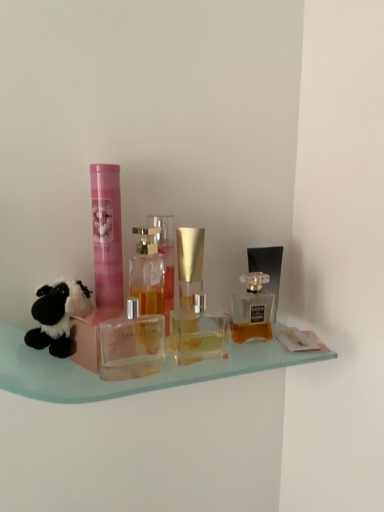
Question: Is matte black perfume at right, which is counted as the 2th toiletry, starting from the left, completely or partially outside of clear glass perfume bottle at center, which appears as the 3th bottle when viewed from the right?

Choices:
 (A) no
 (B) yes

Answer: (B)

Question: Is matte black perfume at right, acting as the first toiletry starting from the right, facing towards clear glass perfume bottle at center, positioned as the second bottle in left-to-right order?

Choices:
 (A) no
 (B) yes

Answer: (A)

Question: Is matte black perfume at right, which is counted as the 2th toiletry, starting from the left, in front of clear glass perfume bottle at center, which appears as the 3th bottle when viewed from the right?

Choices:
 (A) no
 (B) yes

Answer: (A)

Question: Is matte black perfume at right, acting as the first toiletry starting from the right, looking in the opposite direction of clear glass perfume bottle at center, positioned as the second bottle in left-to-right order?

Choices:
 (A) no
 (B) yes

Answer: (A)

Question: Is matte black perfume at right, acting as the first toiletry starting from the right, to the left of clear glass perfume bottle at center, which appears as the 3th bottle when viewed from the right, from the viewer's perspective?

Choices:
 (A) no
 (B) yes

Answer: (A)

Question: Is matte black perfume at right, acting as the first toiletry starting from the right, in front of or behind pink matte tube at center, which is the 2th toiletry from back to front, in the image?

Choices:
 (A) front
 (B) behind

Answer: (B)

Question: From a real-world perspective, is matte black perfume at right, the 1th toiletry from the back, physically located above or below pink matte tube at center, which is the 2th toiletry from back to front?

Choices:
 (A) below
 (B) above

Answer: (A)

Question: Is matte black perfume at right, the 1th toiletry from the back, inside or outside of pink matte tube at center, which is the 2th toiletry from back to front?

Choices:
 (A) outside
 (B) inside

Answer: (A)

Question: Considering the positions of matte black perfume at right, which is counted as the 2th toiletry, starting from the left, and pink matte tube at center, which is the 2th toiletry from back to front, in the image, is matte black perfume at right, which is counted as the 2th toiletry, starting from the left, bigger or smaller than pink matte tube at center, which is the 2th toiletry from back to front,?

Choices:
 (A) big
 (B) small

Answer: (A)

Question: From a real-world perspective, is clear glass perfume bottle at center, positioned as the fourth bottle in right-to-left order, physically located above or below pink matte tube at center, which ranks as the first toiletry in front-to-back order?

Choices:
 (A) below
 (B) above

Answer: (A)

Question: From the image's perspective, is clear glass perfume bottle at center, which is the 1th bottle from left to right, positioned above or below pink matte tube at center, which ranks as the first toiletry in front-to-back order?

Choices:
 (A) below
 (B) above

Answer: (A)

Question: Is point (157, 305) positioned closer to the camera than point (105, 297)?

Choices:
 (A) closer
 (B) farther

Answer: (A)

Question: Considering the relative positions of clear glass perfume bottle at center, which is the 1th bottle from left to right, and pink matte tube at center, marked as the 1th toiletry in a left-to-right arrangement, in the image provided, is clear glass perfume bottle at center, which is the 1th bottle from left to right, to the left or to the right of pink matte tube at center, marked as the 1th toiletry in a left-to-right arrangement,?

Choices:
 (A) left
 (B) right

Answer: (B)

Question: Visually, is matte glass perfume bottle at center, positioned as the 4th bottle in left-to-right order, positioned to the left or to the right of black plush toy at left?

Choices:
 (A) right
 (B) left

Answer: (A)

Question: Is point (235, 309) closer or farther from the camera than point (38, 310)?

Choices:
 (A) farther
 (B) closer

Answer: (A)